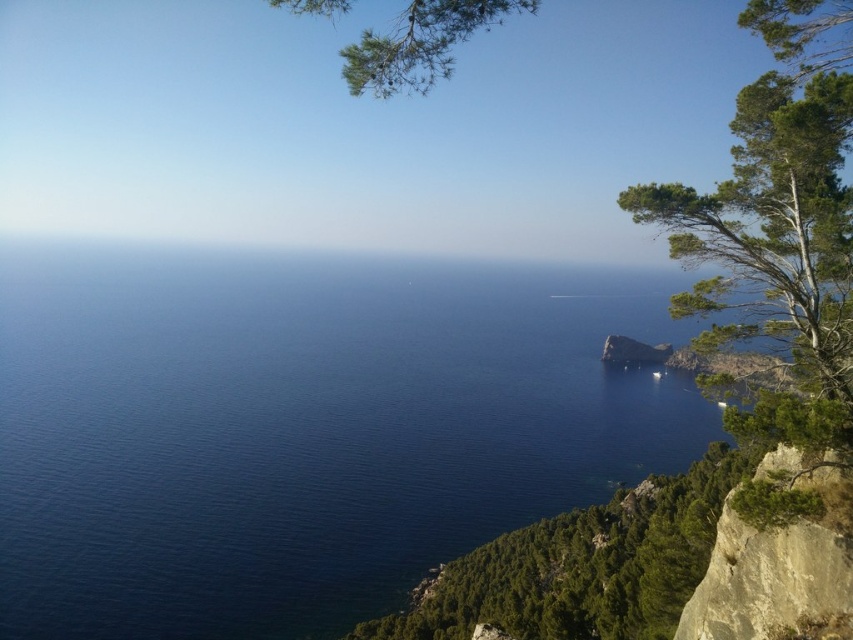
You are standing on the cliff looking out at the deep blue water at center and the rough textured rock at lower right. Which object appears higher in the image?

The deep blue water at center appears higher because it is taller than the rough textured rock at lower right.

You are standing at the cliff edge looking out towards the deep blue water at center. There is also a rough textured rock at lower right in your view. Which object is closer to you, the observer?

The rough textured rock at lower right is behind the deep blue water at center, so the deep blue water at center is closer to you.

You are a geologist examining the coastal landscape. You need to locate the rough textured rock at lower right for a sample collection. According to the coordinates provided, where exactly should you look for it?

The rough textured rock at lower right is located at coordinates point [766,579].